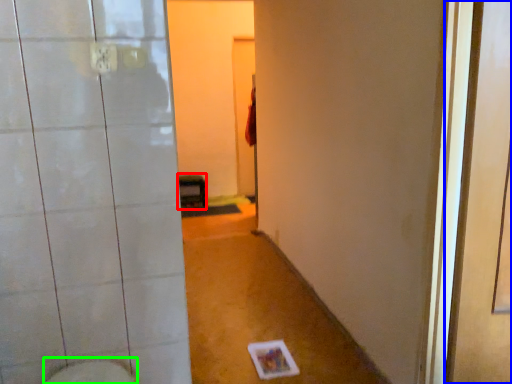
Question: Based on their relative distances, which object is farther from furniture (highlighted by a red box)? Choose from screen door (highlighted by a blue box) and bidet (highlighted by a green box).

Choices:
 (A) screen door
 (B) bidet

Answer: (A)